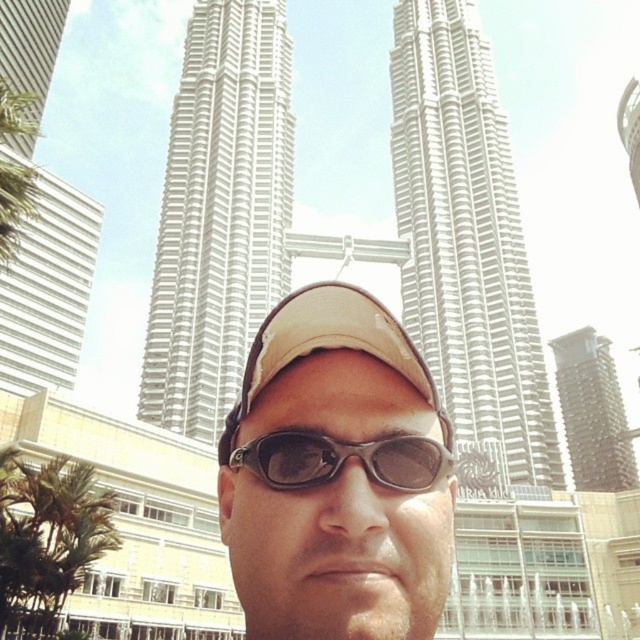
Question: Which of the following is the closest to the observer?

Choices:
 (A) (419, 93)
 (B) (70, 532)
 (C) (244, 449)

Answer: (C)

Question: Is white smooth tower at center further to camera compared to white smooth building at left?

Choices:
 (A) no
 (B) yes

Answer: (B)

Question: Can you confirm if matte beige cap at center is smaller than black rubber goggles at center?

Choices:
 (A) yes
 (B) no

Answer: (B)

Question: Is white metallic tower at center below green leafy palm tree at lower left?

Choices:
 (A) yes
 (B) no

Answer: (B)

Question: Estimate the real-world distances between objects in this image. Which object is farther from the white smooth tower at center?

Choices:
 (A) white smooth building at left
 (B) dark brown textured building at right
 (C) white metallic tower at center

Answer: (B)

Question: Which of these objects is positioned closest to the dark brown textured building at right?

Choices:
 (A) white metallic tower at center
 (B) white smooth building at left

Answer: (A)